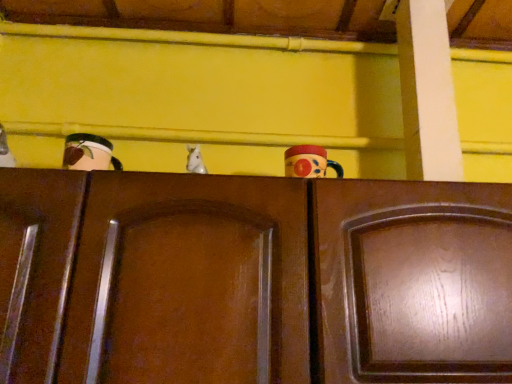
This screenshot has height=384, width=512. Describe the element at coordinates (309, 162) in the screenshot. I see `glossy ceramic mug at upper center, the first toy when ordered from right to left` at that location.

The width and height of the screenshot is (512, 384). What do you see at coordinates (192, 280) in the screenshot?
I see `glossy wood door at center, the first door when ordered from left to right` at bounding box center [192, 280].

The width and height of the screenshot is (512, 384). I want to click on glossy ceramic mug at upper center, which ranks as the second toy in left-to-right order, so click(x=309, y=162).

Could you tell me if wooden cabinet at center, the 2th door from the left, is turned towards white glossy horse at center, placed as the 1th toy when sorted from left to right?

No.

Locate an element on the screen. the 2nd toy above when counting from the wooden cabinet at center, the 2th door from the left (from the image's perspective) is located at coordinates (195, 160).

Considering the sizes of objects wooden cabinet at center, the 2th door from the left, and white glossy horse at center, placed as the 1th toy when sorted from left to right, in the image provided, who is wider, wooden cabinet at center, the 2th door from the left, or white glossy horse at center, placed as the 1th toy when sorted from left to right,?

wooden cabinet at center, the 2th door from the left, is wider.

Does glossy ceramic mug at upper center, which ranks as the second toy in left-to-right order, have a larger size compared to wooden cabinet at center, placed as the first door when sorted from right to left?

No.

Is wooden cabinet at center, placed as the first door when sorted from right to left, located within glossy ceramic mug at upper center, the first toy when ordered from right to left?

That's incorrect, wooden cabinet at center, placed as the first door when sorted from right to left, is not inside glossy ceramic mug at upper center, the first toy when ordered from right to left.

Considering the positions of objects glossy ceramic mug at upper center, which ranks as the second toy in left-to-right order, and wooden cabinet at center, placed as the first door when sorted from right to left, in the image provided, who is in front, glossy ceramic mug at upper center, which ranks as the second toy in left-to-right order, or wooden cabinet at center, placed as the first door when sorted from right to left,?

wooden cabinet at center, placed as the first door when sorted from right to left, is in front.

Is glossy ceramic mug at upper center, the first toy when ordered from right to left, beside wooden cabinet at center, placed as the first door when sorted from right to left?

No, glossy ceramic mug at upper center, the first toy when ordered from right to left, is not in contact with wooden cabinet at center, placed as the first door when sorted from right to left.

Between wooden cabinet at center, placed as the first door when sorted from right to left, and glossy wood door at center, which is the 2th door from right to left, which one has more height?

glossy wood door at center, which is the 2th door from right to left, is taller.

Does wooden cabinet at center, the 2th door from the left, come in front of glossy wood door at center, which is the 2th door from right to left?

No, wooden cabinet at center, the 2th door from the left, is further to the viewer.

Do you think wooden cabinet at center, the 2th door from the left, is within glossy wood door at center, which is the 2th door from right to left, or outside of it?

wooden cabinet at center, the 2th door from the left, is located beyond the bounds of glossy wood door at center, which is the 2th door from right to left.

Which of these two, white glossy horse at center, the second toy in the right-to-left sequence, or glossy ceramic mug at upper center, the first toy when ordered from right to left, is thinner?

white glossy horse at center, the second toy in the right-to-left sequence, is thinner.

Between point (192, 145) and point (318, 153), which one is positioned in front?

The point (318, 153) is closer to the camera.

Consider the image. Is glossy ceramic mug at upper center, which ranks as the second toy in left-to-right order, surrounded by white glossy horse at center, placed as the 1th toy when sorted from left to right?

No, glossy ceramic mug at upper center, which ranks as the second toy in left-to-right order, is not a part of white glossy horse at center, placed as the 1th toy when sorted from left to right.

Is white glossy horse at center, the second toy in the right-to-left sequence, positioned far away from glossy ceramic mug at upper center, which ranks as the second toy in left-to-right order?

Actually, white glossy horse at center, the second toy in the right-to-left sequence, and glossy ceramic mug at upper center, which ranks as the second toy in left-to-right order, are a little close together.

Can you confirm if glossy ceramic mug at upper center, which ranks as the second toy in left-to-right order, is positioned to the right of white glossy horse at center, the second toy in the right-to-left sequence?

Indeed, glossy ceramic mug at upper center, which ranks as the second toy in left-to-right order, is positioned on the right side of white glossy horse at center, the second toy in the right-to-left sequence.

Between point (304, 169) and point (198, 171), which one is positioned behind?

The point (198, 171) is behind.

Where is `toy on the left of glossy ceramic mug at upper center, the first toy when ordered from right to left`? toy on the left of glossy ceramic mug at upper center, the first toy when ordered from right to left is located at coordinates (195, 160).

Is white glossy horse at center, the second toy in the right-to-left sequence, to the right of glossy wood door at center, the first door when ordered from left to right, from the viewer's perspective?

Indeed, white glossy horse at center, the second toy in the right-to-left sequence, is positioned on the right side of glossy wood door at center, the first door when ordered from left to right.

Based on the photo, is white glossy horse at center, placed as the 1th toy when sorted from left to right, outside of glossy wood door at center, the first door when ordered from left to right?

Indeed, white glossy horse at center, placed as the 1th toy when sorted from left to right, is completely outside glossy wood door at center, the first door when ordered from left to right.

Which object is further away from the camera taking this photo, white glossy horse at center, placed as the 1th toy when sorted from left to right, or glossy wood door at center, the first door when ordered from left to right?

white glossy horse at center, placed as the 1th toy when sorted from left to right, is more distant.

Is white glossy horse at center, placed as the 1th toy when sorted from left to right, touching glossy wood door at center, which is the 2th door from right to left?

white glossy horse at center, placed as the 1th toy when sorted from left to right, and glossy wood door at center, which is the 2th door from right to left, are not in contact.

Looking at their sizes, would you say glossy wood door at center, the first door when ordered from left to right, is wider or thinner than glossy ceramic mug at upper center, which ranks as the second toy in left-to-right order?

Considering their sizes, glossy wood door at center, the first door when ordered from left to right, looks broader than glossy ceramic mug at upper center, which ranks as the second toy in left-to-right order.

Is glossy ceramic mug at upper center, which ranks as the second toy in left-to-right order, a part of glossy wood door at center, which is the 2th door from right to left?

No, glossy ceramic mug at upper center, which ranks as the second toy in left-to-right order, is not surrounded by glossy wood door at center, which is the 2th door from right to left.

Considering the relative positions of glossy wood door at center, the first door when ordered from left to right, and glossy ceramic mug at upper center, the first toy when ordered from right to left, in the image provided, is glossy wood door at center, the first door when ordered from left to right, to the left or to the right of glossy ceramic mug at upper center, the first toy when ordered from right to left,?

glossy wood door at center, the first door when ordered from left to right, is to the left of glossy ceramic mug at upper center, the first toy when ordered from right to left.

Are glossy wood door at center, the first door when ordered from left to right, and glossy ceramic mug at upper center, which ranks as the second toy in left-to-right order, located far from each other?

No.

This screenshot has width=512, height=384. What are the coordinates of `the 1st door in front of the white glossy horse at center, the second toy in the right-to-left sequence` in the screenshot? It's located at (412, 281).

The image size is (512, 384). Find the location of `the 2nd door below when counting from the glossy ceramic mug at upper center, the first toy when ordered from right to left (from the image's perspective)`. the 2nd door below when counting from the glossy ceramic mug at upper center, the first toy when ordered from right to left (from the image's perspective) is located at coordinates [x=412, y=281].

When comparing their distances from wooden cabinet at center, placed as the first door when sorted from right to left, does white glossy horse at center, the second toy in the right-to-left sequence, or glossy wood door at center, which is the 2th door from right to left, seem closer?

glossy wood door at center, which is the 2th door from right to left, is closer to wooden cabinet at center, placed as the first door when sorted from right to left.

Considering their positions, is wooden cabinet at center, placed as the first door when sorted from right to left, positioned further to glossy ceramic mug at upper center, which ranks as the second toy in left-to-right order, than white glossy horse at center, the second toy in the right-to-left sequence?

wooden cabinet at center, placed as the first door when sorted from right to left, is further to glossy ceramic mug at upper center, which ranks as the second toy in left-to-right order.

When comparing their distances from white glossy horse at center, placed as the 1th toy when sorted from left to right, does wooden cabinet at center, placed as the first door when sorted from right to left, or glossy ceramic mug at upper center, which ranks as the second toy in left-to-right order, seem further?

wooden cabinet at center, placed as the first door when sorted from right to left, is positioned further to the anchor white glossy horse at center, placed as the 1th toy when sorted from left to right.

Estimate the real-world distances between objects in this image. Which object is further from wooden cabinet at center, the 2th door from the left, glossy ceramic mug at upper center, which ranks as the second toy in left-to-right order, or glossy wood door at center, the first door when ordered from left to right?

Based on the image, glossy ceramic mug at upper center, which ranks as the second toy in left-to-right order, appears to be further to wooden cabinet at center, the 2th door from the left.

Based on their spatial positions, is wooden cabinet at center, the 2th door from the left, or glossy wood door at center, the first door when ordered from left to right, further from glossy ceramic mug at upper center, the first toy when ordered from right to left?

glossy wood door at center, the first door when ordered from left to right, lies further to glossy ceramic mug at upper center, the first toy when ordered from right to left, than the other object.

From the image, which object appears to be nearer to wooden cabinet at center, placed as the first door when sorted from right to left, glossy ceramic mug at upper center, which ranks as the second toy in left-to-right order, or white glossy horse at center, the second toy in the right-to-left sequence?

glossy ceramic mug at upper center, which ranks as the second toy in left-to-right order, lies closer to wooden cabinet at center, placed as the first door when sorted from right to left, than the other object.

Considering their positions, is glossy wood door at center, the first door when ordered from left to right, positioned further to wooden cabinet at center, the 2th door from the left, than white glossy horse at center, the second toy in the right-to-left sequence?

white glossy horse at center, the second toy in the right-to-left sequence, is further to wooden cabinet at center, the 2th door from the left.

Estimate the real-world distances between objects in this image. Which object is closer to glossy wood door at center, the first door when ordered from left to right, wooden cabinet at center, the 2th door from the left, or white glossy horse at center, the second toy in the right-to-left sequence?

The object closer to glossy wood door at center, the first door when ordered from left to right, is wooden cabinet at center, the 2th door from the left.

Find the location of `toy between glossy wood door at center, the first door when ordered from left to right, and glossy ceramic mug at upper center, the first toy when ordered from right to left, in the horizontal direction`. toy between glossy wood door at center, the first door when ordered from left to right, and glossy ceramic mug at upper center, the first toy when ordered from right to left, in the horizontal direction is located at coordinates (195, 160).

What are the coordinates of `toy between white glossy horse at center, the second toy in the right-to-left sequence, and wooden cabinet at center, the 2th door from the left, from left to right` in the screenshot? It's located at (309, 162).